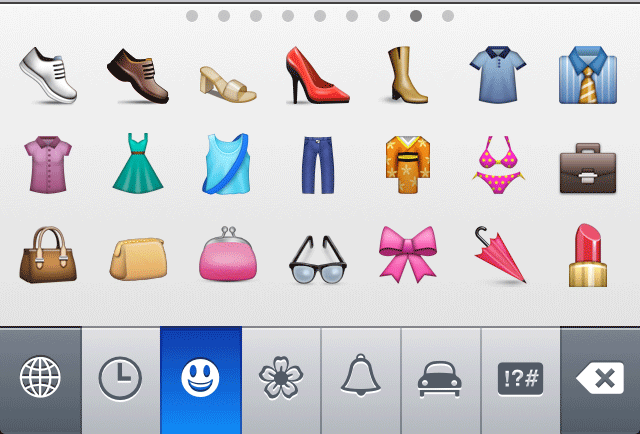
The height and width of the screenshot is (434, 640). I want to click on shoe, so click(54, 79), click(136, 83), click(227, 80), click(316, 75), click(410, 77).